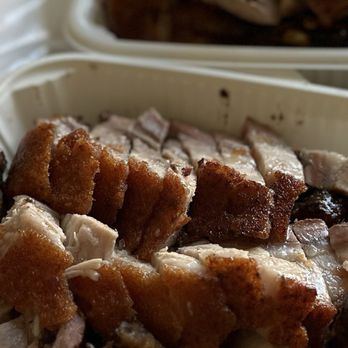
Identify the location of bottom tray. This screenshot has width=348, height=348. (210, 100).